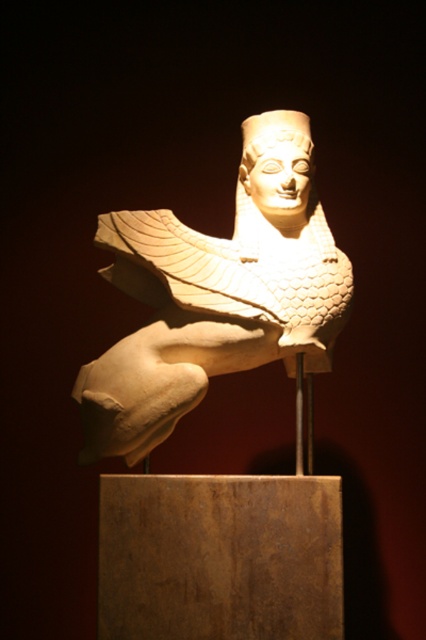
Looking at this image, who is taller, white stone bird at center or white glossy head at center?

With more height is white stone bird at center.

Does white stone bird at center have a larger size compared to white glossy head at center?

Yes, white stone bird at center is bigger than white glossy head at center.

Does point (187, 291) come closer to viewer compared to point (264, 129)?

Yes, it is.

You are a GUI agent. You are given a task and a screenshot of the screen. Output one action in this format:
    pyautogui.click(x=<x>, y=<y>)
    Task: Click on the white stone bird at center
    
    Given the screenshot: What is the action you would take?
    pyautogui.click(x=216, y=294)